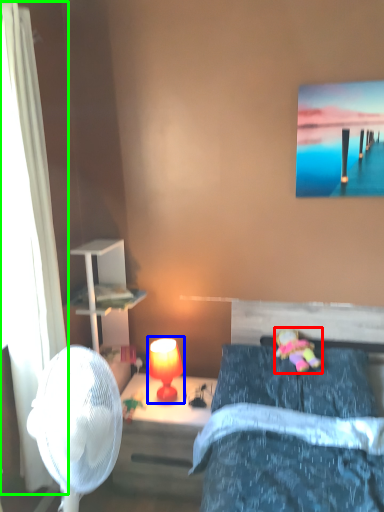
Question: Which object is the farthest from toy (highlighted by a red box)? Choose among these: table lamp (highlighted by a blue box) or curtain (highlighted by a green box).

Choices:
 (A) table lamp
 (B) curtain

Answer: (B)